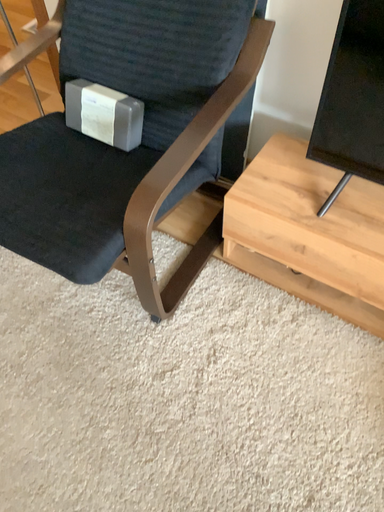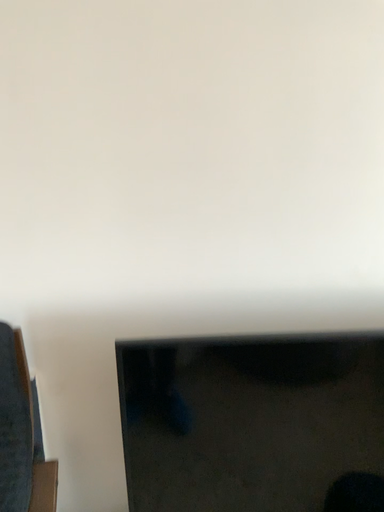
Question: Which way did the camera rotate in the video?

Choices:
 (A) rotated left
 (B) rotated right

Answer: (B)